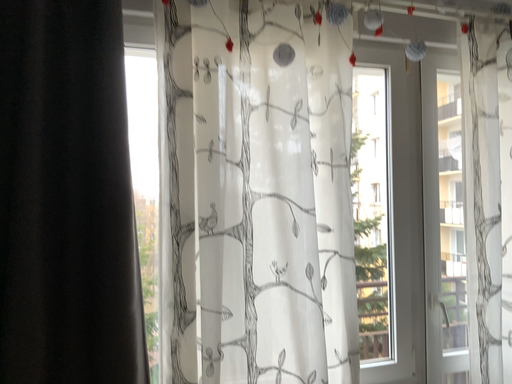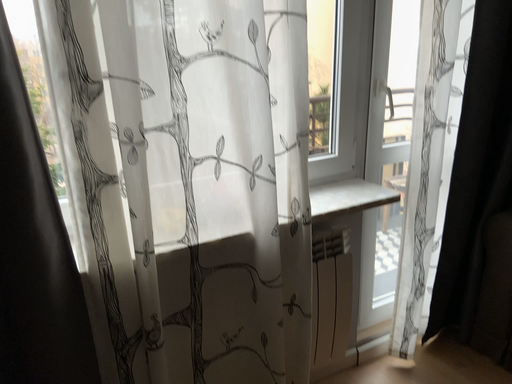
Question: How did the camera likely rotate when shooting the video?

Choices:
 (A) rotated right
 (B) rotated left

Answer: (A)